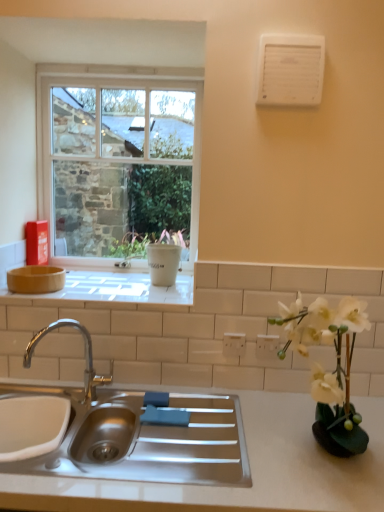
In order to click on unoccupied space behind white matte vase at right in this screenshot , I will do `click(283, 418)`.